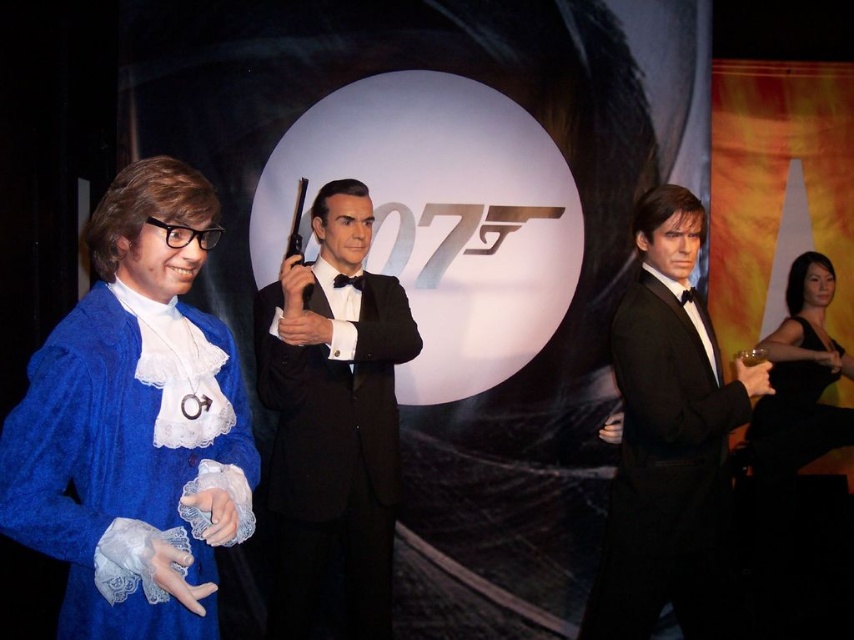
You are a photographer setting up for a James Bond themed photoshoot. You need to place a red spotlight at point [135,424]. What object will be illuminated by this spotlight?

The red spotlight at point [135,424] will illuminate the blue velvet dress at left.

You are a photographer setting up a shot for a James Bond themed event. You have two points marked on your camera screen at coordinates point [595,612] and point [336,285]. Which point is closer to the camera lens?

Point [595,612] is in front of point [336,285], so it is closer to the camera lens.

You are a photographer setting up for a photoshoot in front of the 007 backdrop. You need to ensure that both the blue velvet dress at left and the black satin dress at right are visible in the frame. Given their current positions, which dress is covering part of the other?

The blue velvet dress at left is positioned over the black satin dress at right, so it is covering part of it.